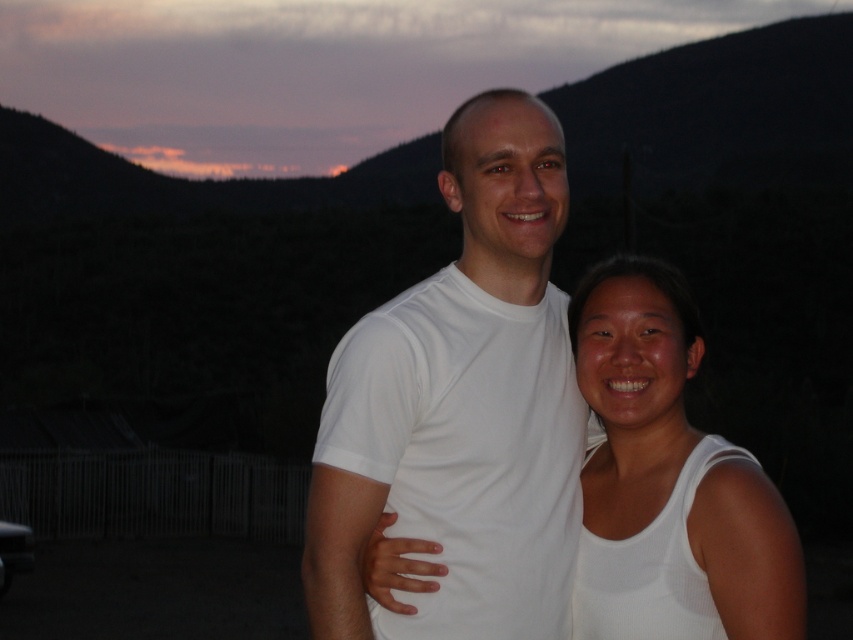
Does white matte t-shirt at center have a greater width compared to white matte tank top at center?

Yes.

This screenshot has height=640, width=853. In order to click on white matte t-shirt at center in this screenshot , I will do `click(461, 404)`.

Locate an element on the screen. white matte t-shirt at center is located at coordinates (461, 404).

The width and height of the screenshot is (853, 640). What are the coordinates of `white matte t-shirt at center` in the screenshot? It's located at (461, 404).